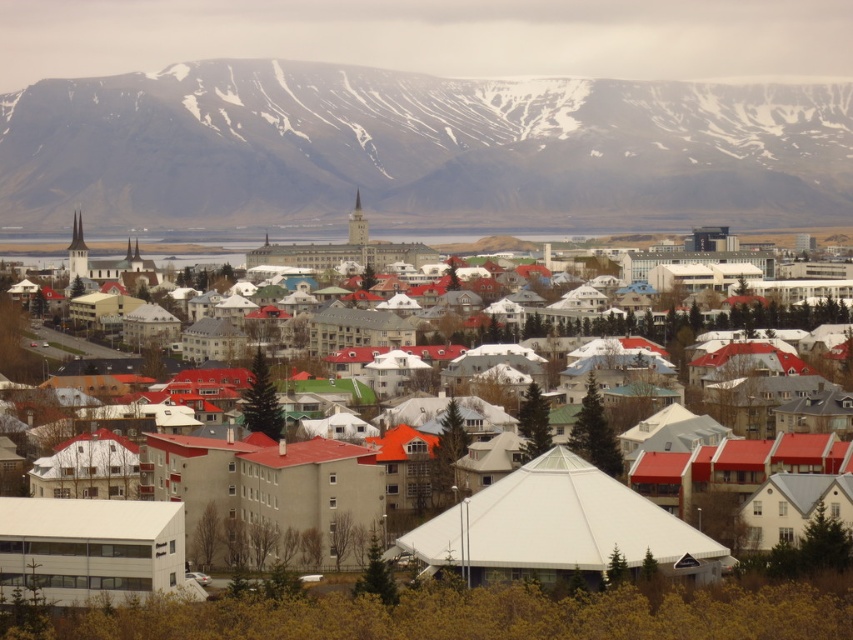
You are a hiker planning to reach the snowy rock formation at upper center. The trail you are on is 500 meters long. Can you reach the formation before the trail ends?

The snowy rock formation at upper center is 621.41 meters from the camera, so the trail is only 500 meters long, meaning you cannot reach the formation before the trail ends.

You are planning to take a photo of the snowy rock formation at upper center and the white matte tent at center. Which object should you focus on first if you want to capture both in a single frame without moving the camera?

The snowy rock formation at upper center is smaller than the white matte tent at center, so you should focus on the white matte tent at center first to ensure it is in clear view before adjusting for the smaller snowy rock formation at upper center.

You are standing in the town and looking at the snowy rock formation at upper center marked by point (419,148). Which direction should you face to see the large white tent like structure in the center right of the image?

The large white tent like structure is located to the right of the snowy rock formation at upper center marked by point (419,148). So you should face towards the right direction to see it.